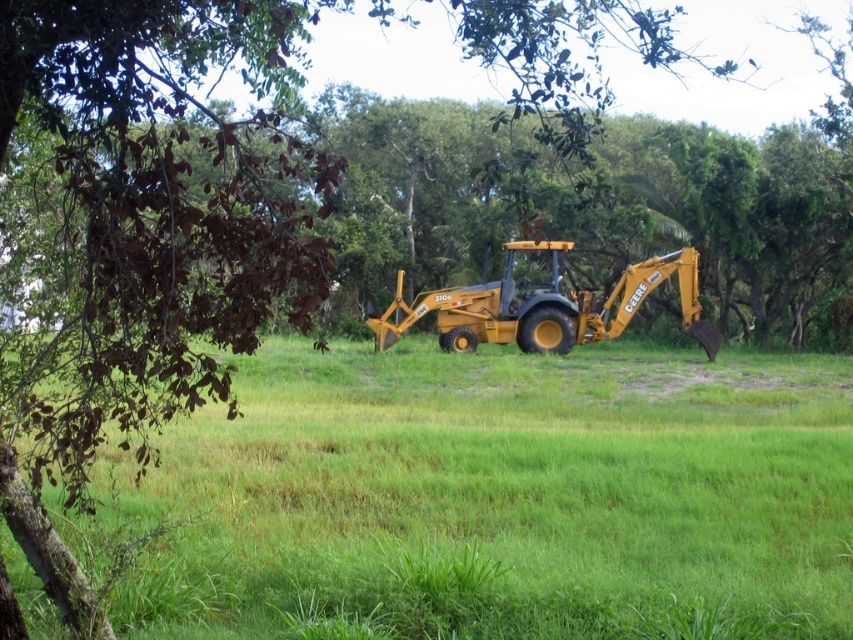
You are a farmer who needs to decide which tractor to use for plowing a muddy field. Both the yellow rubber tractor at center and the yellow metallic tractor at center are available. Based on their descriptions, which one would be more suitable for the task?

The yellow rubber tractor at center is more suitable for plowing a muddy field because rubber tires provide better traction in slippery conditions compared to metallic ones.

You are a photographer standing at the camera position. You want to take a photo of the yellow rubber tractor at center. However, there is a 5.5 meter long fence blocking your path. Can you reach the tractor without going around the fence?

The yellow rubber tractor at center is 5.73 meters away from the camera. Since the fence is only 5.5 meters long, the tractor is just beyond the fence. Therefore, you cannot reach the tractor without going around the fence because the fence extends further than the distance to the tractor.